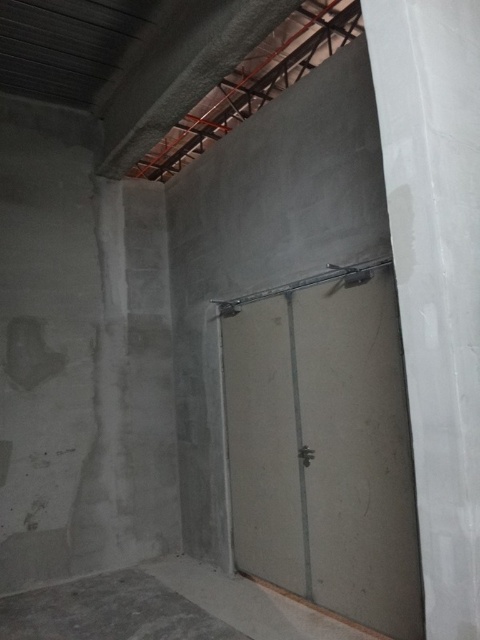
Between point (472, 531) and point (60, 602), which one is positioned in front?

Positioned in front is point (472, 531).

Is white glossy pillar at right closer to camera compared to gray concrete floor at lower left?

Yes.

Who is more forward, (395, 252) or (166, 609)?

Point (395, 252) is in front.

I want to click on white glossy pillar at right, so click(436, 276).